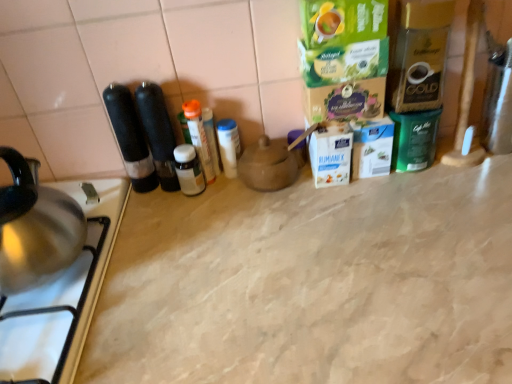
You are a GUI agent. You are given a task and a screenshot of the screen. Output one action in this format:
    pyautogui.click(x=<x>, y=<y>)
    Task: Click on the blank space situated above beige marble counter top at center (from a real-world perspective)
    The height and width of the screenshot is (384, 512).
    Given the screenshot: What is the action you would take?
    pyautogui.click(x=280, y=257)